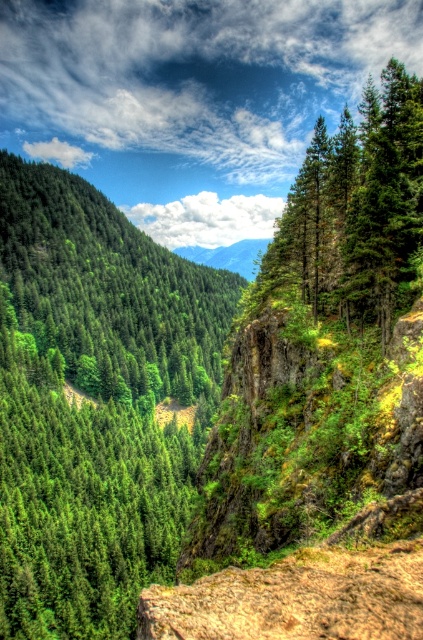
You are standing at the cliff face in the foreground of the mountain landscape. You notice two points marked in the scene. Which of the two points, point (382, 204) or point (227, 268), is closer to you?

Point (382, 204) is closer to the viewer than point (227, 268).

You are hiking in the mountain area shown in the image. You see a green matte tree at left and a green matte tree at upper right. Which tree is positioned more to the left side of the image?

The green matte tree at left is positioned more to the left side of the image than the green matte tree at upper right.